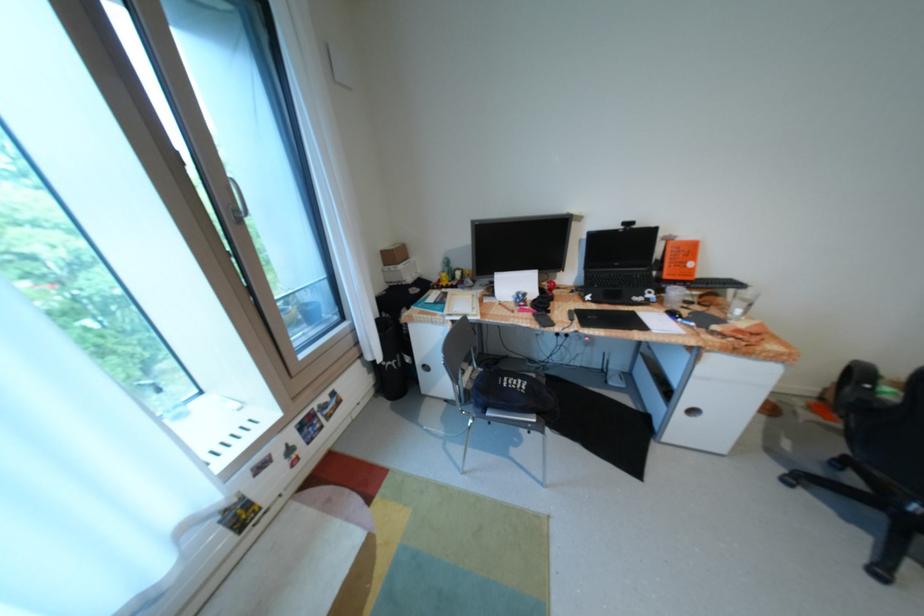
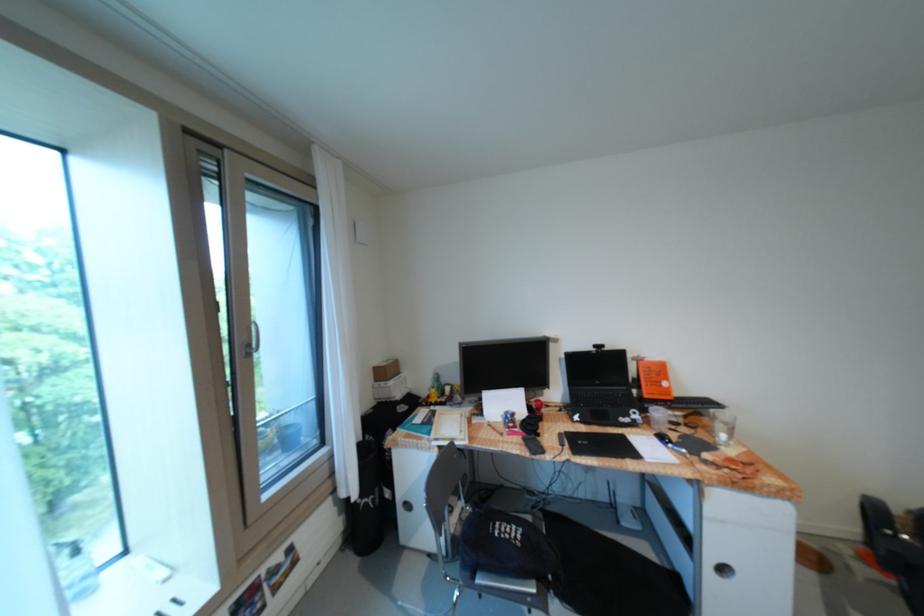
Question: The first image is from the beginning of the video and the second image is from the end. How did the camera likely rotate when shooting the video?

Choices:
 (A) Left
 (B) Right
 (C) Up
 (D) Down

Answer: (C)